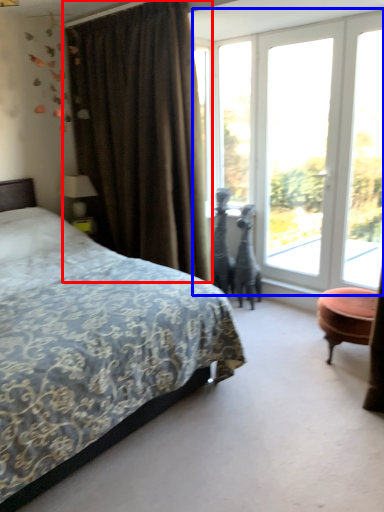
Question: Which point is closer to the camera, curtain (highlighted by a red box) or window (highlighted by a blue box)?

Choices:
 (A) curtain
 (B) window

Answer: (A)